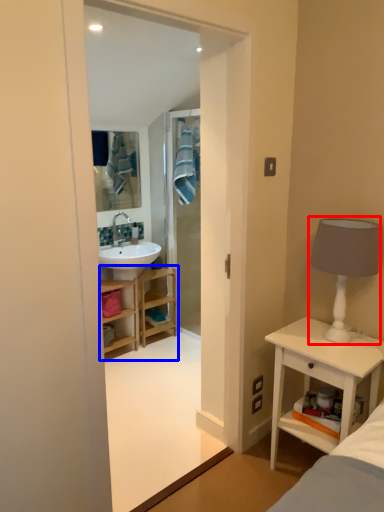
Question: Among these objects, which one is farthest to the camera, table lamp (highlighted by a red box) or bathroom cabinet (highlighted by a blue box)?

Choices:
 (A) table lamp
 (B) bathroom cabinet

Answer: (B)